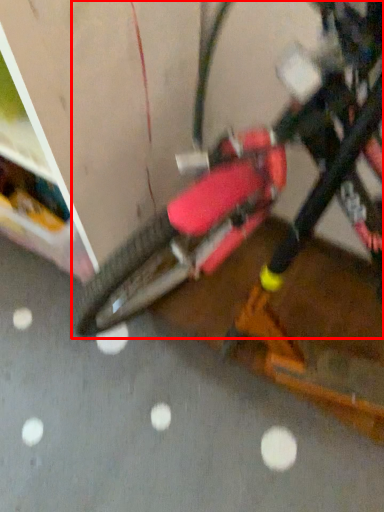
Question: From the image's perspective, considering the relative positions of bicycle (annotated by the red box) and concrete in the image provided, where is bicycle (annotated by the red box) located with respect to the staircase?

Choices:
 (A) below
 (B) above

Answer: (B)